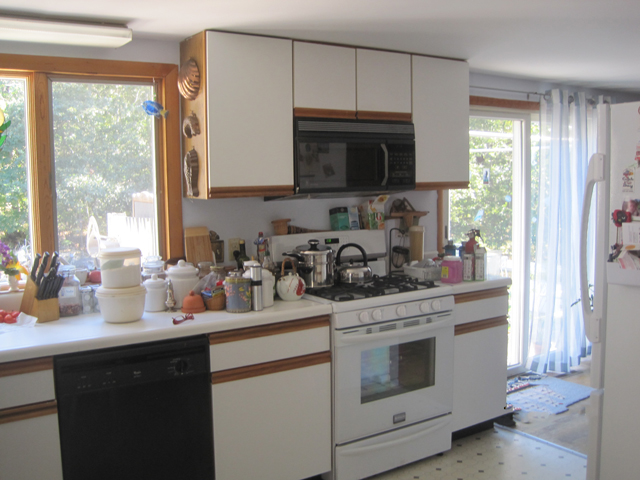
Image resolution: width=640 pixels, height=480 pixels. I want to click on window, so click(524, 179).